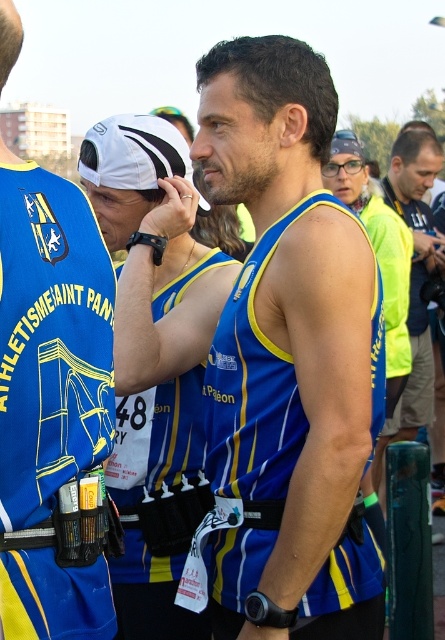
Consider the image. You are a participant in the running event and want to move from the starting line to the finish line. There are two points marked in the image. One is at point (1, 232) and the other is at point (391, 196). Which point should you aim for first if you want to take the shortest path to the finish line?

Point (1, 232) is in front of point (391, 196), so you should aim for point (1, 232) first to take the shortest path to the finish line.